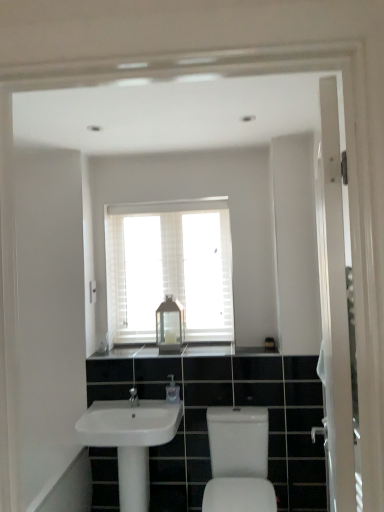
You are a GUI agent. You are given a task and a screenshot of the screen. Output one action in this format:
    pyautogui.click(x=<x>, y=<y>)
    Task: Click on the vacant space in front of metallic glass lantern at center
    
    Given the screenshot: What is the action you would take?
    pyautogui.click(x=162, y=352)